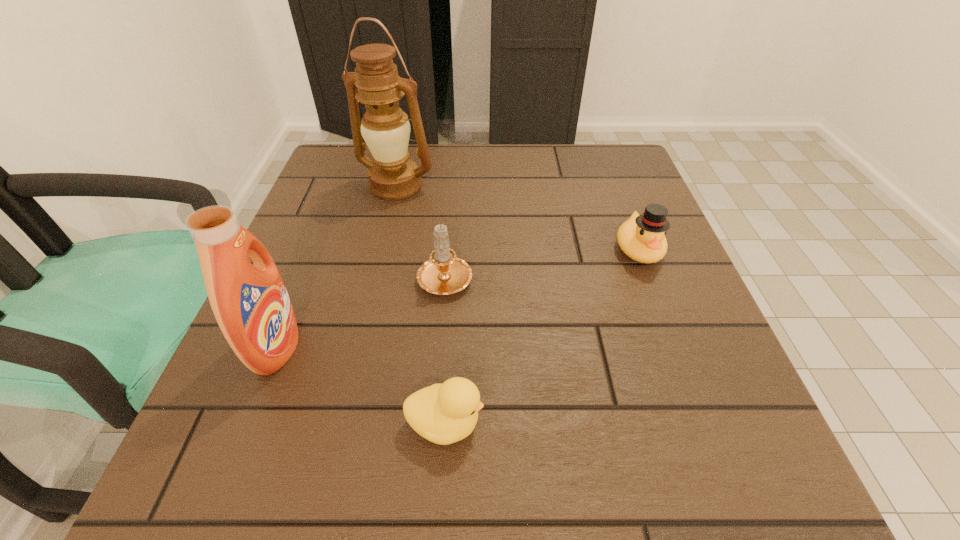
Identify the location of oil lamp. The height and width of the screenshot is (540, 960). (385, 128).

Locate an element on the screen. The width and height of the screenshot is (960, 540). the farthest object is located at coordinates (385, 128).

Find the location of a particular element. This screenshot has height=540, width=960. the second tallest object is located at coordinates (251, 305).

You are a GUI agent. You are given a task and a screenshot of the screen. Output one action in this format:
    pyautogui.click(x=<x>, y=<y>)
    Task: Click on the detergent
    
    Given the screenshot: What is the action you would take?
    pyautogui.click(x=251, y=305)

The image size is (960, 540). I want to click on candle, so click(444, 274).

You are a GUI agent. You are given a task and a screenshot of the screen. Output one action in this format:
    pyautogui.click(x=<x>, y=<y>)
    Task: Click on the rightmost object
    The width and height of the screenshot is (960, 540).
    Given the screenshot: What is the action you would take?
    pyautogui.click(x=642, y=237)

At what (x,y) coordinates should I click in order to perform the action: click on the taller duck. Please return your answer as a coordinate pair (x, y). The width and height of the screenshot is (960, 540). Looking at the image, I should click on (642, 237).

Find the location of `the nearer duck`. the nearer duck is located at coordinates (445, 413).

At what (x,y) coordinates should I click in order to perform the action: click on the shorter duck. Please return your answer as a coordinate pair (x, y). Image resolution: width=960 pixels, height=540 pixels. Looking at the image, I should click on (445, 413).

Where is `blank space located on the front of the tallest object`? This screenshot has width=960, height=540. blank space located on the front of the tallest object is located at coordinates (360, 335).